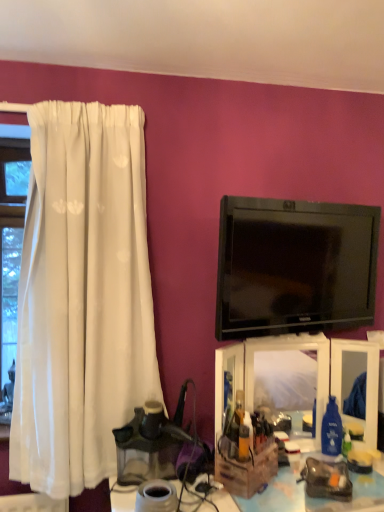
Question: Based on their positions, is wooden crate at lower right located to the left or right of black glossy tv at upper right?

Choices:
 (A) left
 (B) right

Answer: (A)

Question: Does point (359, 479) appear closer or farther from the camera than point (365, 309)?

Choices:
 (A) farther
 (B) closer

Answer: (B)

Question: Based on their relative distances, which object is farther from the black glossy tv at upper right?

Choices:
 (A) wooden crate at lower right
 (B) translucent plastic makeup organizer at center

Answer: (A)

Question: Estimate the real-world distances between objects in this image. Which object is closer to the wooden crate at lower right?

Choices:
 (A) black glossy tv at upper right
 (B) translucent plastic makeup organizer at center

Answer: (B)